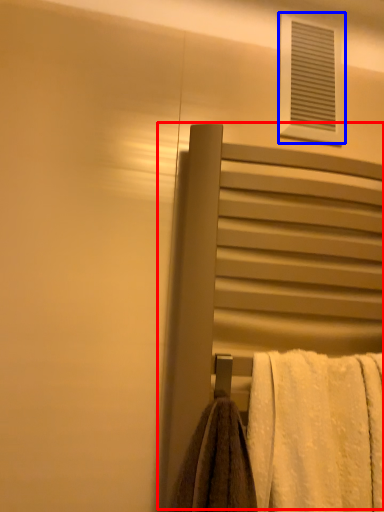
Question: Which of the following is the farthest to the observer, screen door (highlighted by a red box) or window (highlighted by a blue box)?

Choices:
 (A) screen door
 (B) window

Answer: (B)